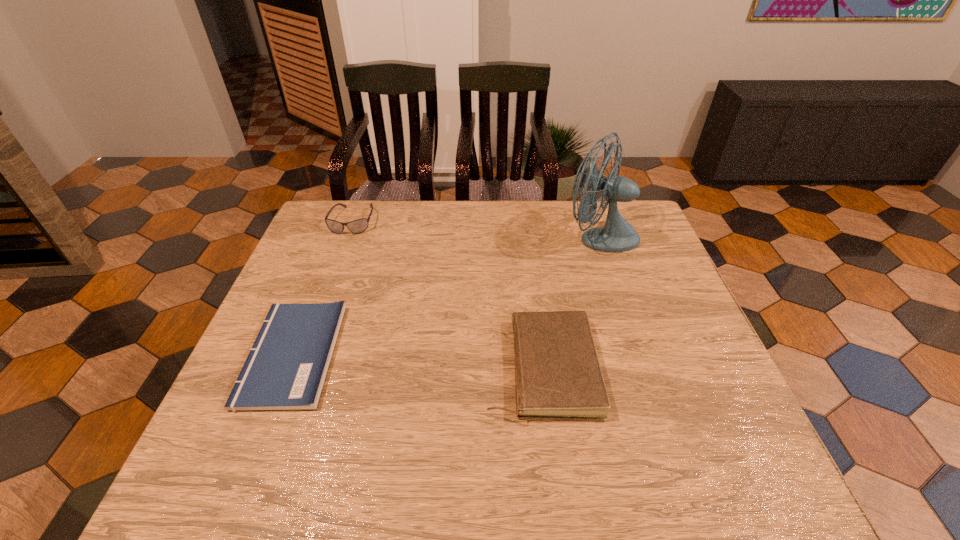
This screenshot has height=540, width=960. Find the location of `fan`. fan is located at coordinates (617, 235).

You are a GUI agent. You are given a task and a screenshot of the screen. Output one action in this format:
    pyautogui.click(x=<x>, y=<y>)
    Task: Click on the sunglasses
    Image resolution: width=960 pixels, height=540 pixels.
    Given the screenshot: What is the action you would take?
    pyautogui.click(x=358, y=226)

You are a GUI agent. You are given a task and a screenshot of the screen. Output one action in this format:
    pyautogui.click(x=<x>, y=<y>)
    Task: Click on the taller paperback book
    
    Given the screenshot: What is the action you would take?
    pyautogui.click(x=557, y=372)

You are a GUI agent. You are given a task and a screenshot of the screen. Output one action in this format:
    pyautogui.click(x=<x>, y=<y>)
    Task: Click on the shortest object
    Image resolution: width=960 pixels, height=540 pixels.
    Given the screenshot: What is the action you would take?
    pyautogui.click(x=286, y=367)

Image resolution: width=960 pixels, height=540 pixels. Find the location of `the shorter paperback book`. the shorter paperback book is located at coordinates (286, 367).

Identify the location of free space located 0.190m in front of the tallest object to blow air. (500, 237).

Image resolution: width=960 pixels, height=540 pixels. Find the location of `vacant region located in front of the tallest object to blow air`. vacant region located in front of the tallest object to blow air is located at coordinates (529, 237).

Find the location of a particular element. The width and height of the screenshot is (960, 540). vacant space located 0.290m in front of the tallest object to blow air is located at coordinates (468, 237).

Locate an element on the screen. The image size is (960, 540). free space located 0.360m on the lenses of the sunglasses is located at coordinates (315, 322).

Identify the location of free space located 0.080m on the spine side of the right paperback book. The image size is (960, 540). (451, 368).